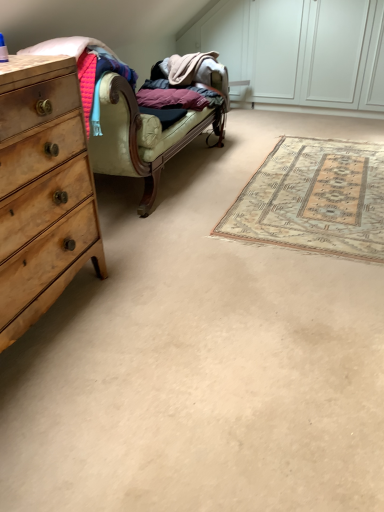
I want to click on vacant area that is situated to the right of wooden chest of drawers at left, so click(x=160, y=317).